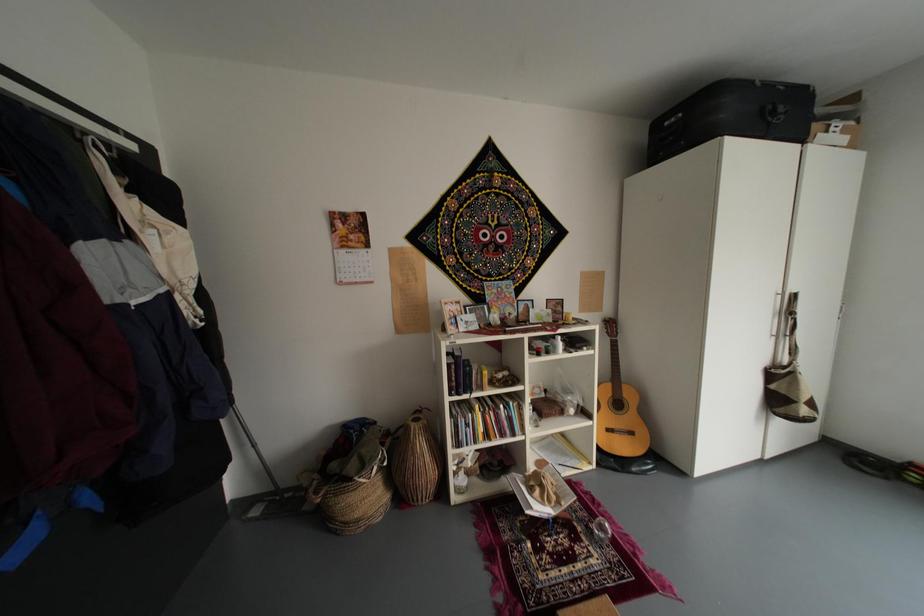
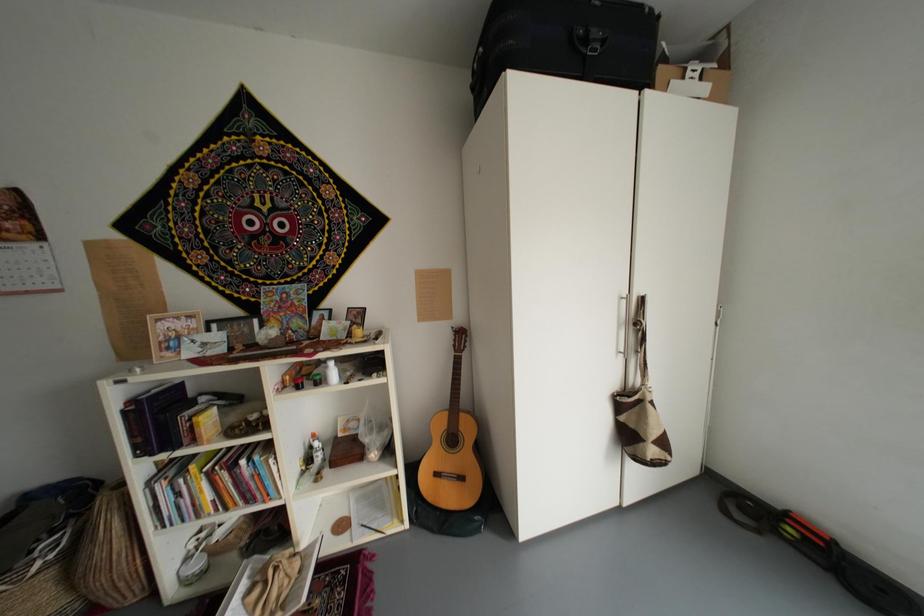
Question: In a continuous first-person perspective shot, in which direction is the camera moving?

Choices:
 (A) Left
 (B) Right
 (C) Forward
 (D) Backward

Answer: (B)